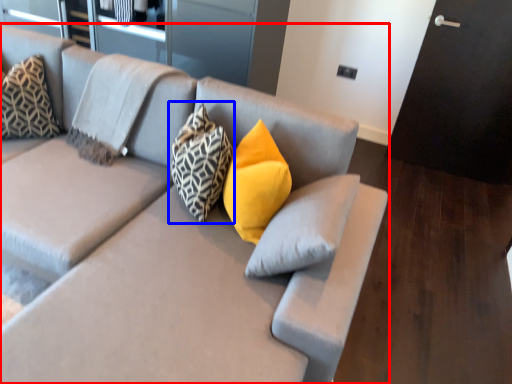
Question: Among these objects, which one is nearest to the camera, studio couch (highlighted by a red box) or pillow (highlighted by a blue box)?

Choices:
 (A) studio couch
 (B) pillow

Answer: (A)